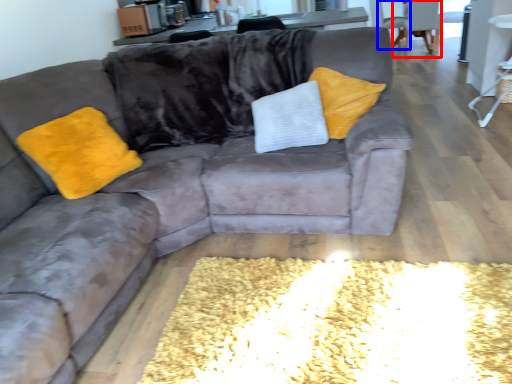
Question: Which object is further to the camera taking this photo, armchair (highlighted by a red box) or armchair (highlighted by a blue box)?

Choices:
 (A) armchair
 (B) armchair

Answer: (B)